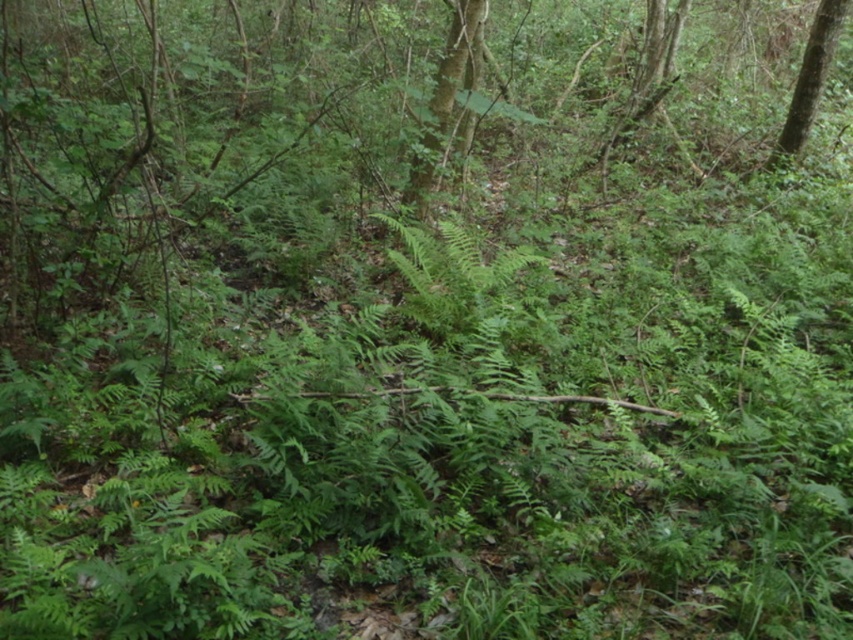
You are standing in the forest and want to take a photo of the green leafy tree at upper center. If your camera has a maximum focus range of 6 meters, will you be able to capture it clearly?

The green leafy tree at upper center is 6.40 meters away from the viewer, which exceeds the camera maximum focus range of 6 meters. Therefore, you won

You are a park ranger measuring the distance between two trees in the forest. You have a measuring tape that can extend up to 10 feet. Can you measure the distance between the green leafy tree at upper center and the green leafy tree at upper right without needing to extend the tape beyond its limit?

The green leafy tree at upper center and green leafy tree at upper right are 11.59 feet apart from each other, so the measuring tape that can extend up to 10 feet is not long enough to measure the distance between the green leafy tree at upper center and the green leafy tree at upper right without needing to extend beyond its limit.

You are standing in the forest and want to find the green leafy tree at upper center. Based on its coordinates, where should you look relative to your current position?

The green leafy tree at upper center is located at coordinates point (450, 99), which means it is positioned slightly to the left and halfway up from the bottom of your field of view.